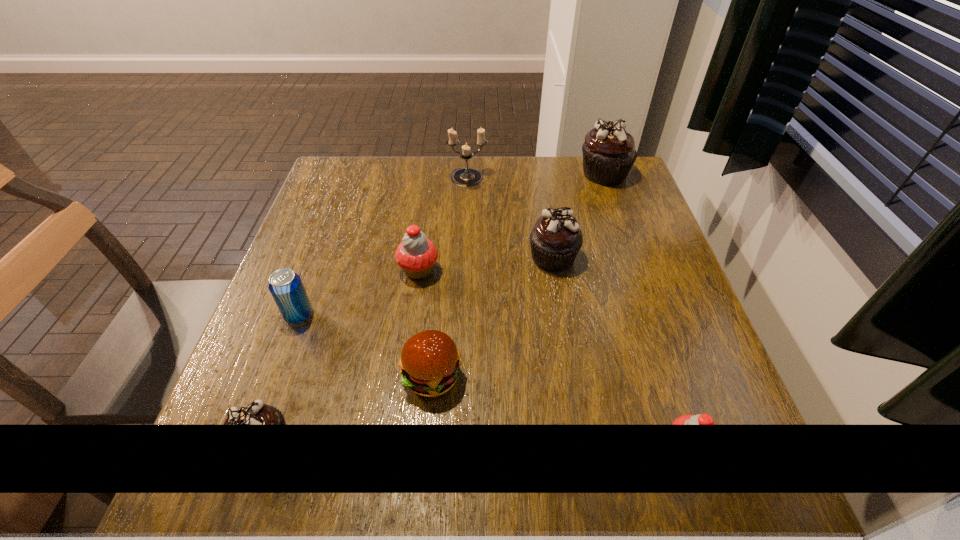
Find the location of `unoccupied position between the candle holder and the fourth nearest object`. unoccupied position between the candle holder and the fourth nearest object is located at coordinates [383, 247].

Where is `free space between the right red cupcake and the brown hamburger`? free space between the right red cupcake and the brown hamburger is located at coordinates (560, 411).

The height and width of the screenshot is (540, 960). I want to click on blank region between the smaller red cupcake and the fourth cupcake from right to left, so click(x=553, y=358).

Locate an element on the screen. This screenshot has width=960, height=540. object that ranks as the closest to the farther red cupcake is located at coordinates (285, 286).

Locate an element on the screen. This screenshot has width=960, height=540. object identified as the fifth closest to the second nearest brown cupcake is located at coordinates (701, 419).

Locate an element on the screen. The image size is (960, 540). the second closest cupcake to the beer can is located at coordinates (256, 413).

Identify the location of cupcake that stands as the fourth closest to the fifth farthest object. (701, 419).

At what (x,y) coordinates should I click in order to perform the action: click on brown cupcake that stands as the second closest to the third cupcake from right to left. Please return your answer as a coordinate pair (x, y). Looking at the image, I should click on (256, 413).

Where is `brown cupcake identified as the closest to the candle holder`? brown cupcake identified as the closest to the candle holder is located at coordinates point(556,238).

In order to click on vacant space that satisfies the following two spatial constraints: 1. on the back side of the candle holder; 2. on the left side of the bigger red cupcake in this screenshot , I will do pyautogui.click(x=431, y=179).